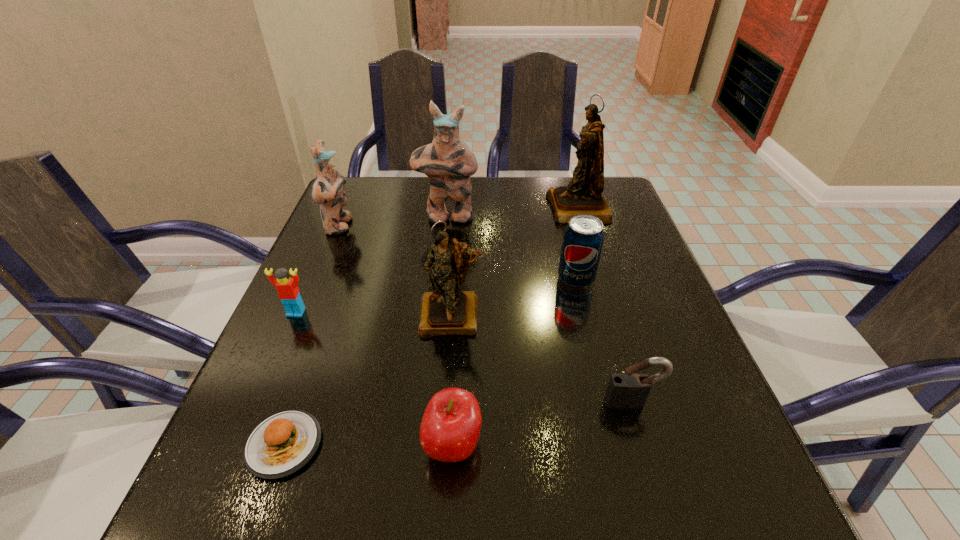
Where is `vacant region that satisfies the following two spatial constraints: 1. on the face of the red apple; 2. on the right side of the Lego`? vacant region that satisfies the following two spatial constraints: 1. on the face of the red apple; 2. on the right side of the Lego is located at coordinates (238, 446).